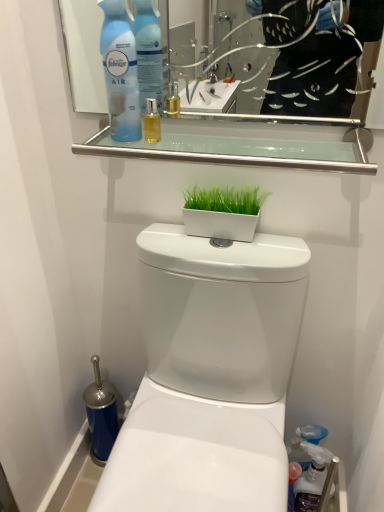
Question: Is blue plastic air freshener at upper left, the first cleaning product in the left-to-right sequence, to the right of white glossy flowerpot at center from the viewer's perspective?

Choices:
 (A) no
 (B) yes

Answer: (A)

Question: Is the depth of blue plastic air freshener at upper left, which appears as the 1th cleaning product when viewed from the top, greater than that of white glossy flowerpot at center?

Choices:
 (A) no
 (B) yes

Answer: (A)

Question: From the image's perspective, does blue plastic air freshener at upper left, which appears as the 2th cleaning product when viewed from the right, appear lower than white glossy flowerpot at center?

Choices:
 (A) yes
 (B) no

Answer: (B)

Question: Is blue plastic air freshener at upper left, which appears as the 1th cleaning product when viewed from the top, looking in the opposite direction of white glossy flowerpot at center?

Choices:
 (A) no
 (B) yes

Answer: (A)

Question: Is white glossy flowerpot at center located within blue plastic air freshener at upper left, which is the 2th cleaning product in bottom-to-top order?

Choices:
 (A) yes
 (B) no

Answer: (B)

Question: Considering the relative sizes of blue plastic air freshener at upper left, which appears as the 1th cleaning product when viewed from the top, and white glossy flowerpot at center in the image provided, is blue plastic air freshener at upper left, which appears as the 1th cleaning product when viewed from the top, taller than white glossy flowerpot at center?

Choices:
 (A) no
 (B) yes

Answer: (B)

Question: From a real-world perspective, is clear glass shelf at upper center physically above white glossy flowerpot at center?

Choices:
 (A) no
 (B) yes

Answer: (B)

Question: Is clear glass shelf at upper center oriented towards white glossy flowerpot at center?

Choices:
 (A) no
 (B) yes

Answer: (A)

Question: Is white glossy flowerpot at center surrounded by clear glass shelf at upper center?

Choices:
 (A) no
 (B) yes

Answer: (A)

Question: Considering the relative sizes of clear glass shelf at upper center and white glossy flowerpot at center in the image provided, is clear glass shelf at upper center wider than white glossy flowerpot at center?

Choices:
 (A) no
 (B) yes

Answer: (B)

Question: Are clear glass shelf at upper center and white glossy flowerpot at center far apart?

Choices:
 (A) yes
 (B) no

Answer: (B)

Question: Considering the relative sizes of clear glass shelf at upper center and white glossy flowerpot at center in the image provided, is clear glass shelf at upper center taller than white glossy flowerpot at center?

Choices:
 (A) no
 (B) yes

Answer: (A)

Question: Is translucent plastic spray bottle at lower right, the 2th cleaning product in the left-to-right sequence, at the right side of blue plastic air freshener at upper left, acting as the second cleaning product starting from the back?

Choices:
 (A) no
 (B) yes

Answer: (B)